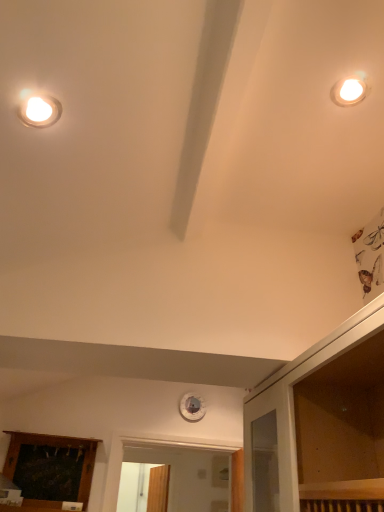
Question: Would you say transparent glass dresser at upper right is part of wooden panel at lower left's contents?

Choices:
 (A) yes
 (B) no

Answer: (B)

Question: Is wooden panel at lower left not within transparent glass dresser at upper right?

Choices:
 (A) yes
 (B) no

Answer: (A)

Question: Does wooden panel at lower left have a larger size compared to transparent glass dresser at upper right?

Choices:
 (A) no
 (B) yes

Answer: (A)

Question: Is the surface of wooden panel at lower left in direct contact with transparent glass dresser at upper right?

Choices:
 (A) no
 (B) yes

Answer: (A)

Question: From a real-world perspective, is wooden panel at lower left positioned over transparent glass dresser at upper right based on gravity?

Choices:
 (A) no
 (B) yes

Answer: (A)

Question: Does wooden panel at lower left lie behind transparent glass dresser at upper right?

Choices:
 (A) no
 (B) yes

Answer: (B)

Question: Considering the relative positions of transparent glass dresser at upper right and wooden panel at lower left in the image provided, is transparent glass dresser at upper right behind wooden panel at lower left?

Choices:
 (A) yes
 (B) no

Answer: (B)

Question: Does transparent glass dresser at upper right appear on the right side of wooden panel at lower left?

Choices:
 (A) yes
 (B) no

Answer: (A)

Question: Is transparent glass dresser at upper right oriented towards wooden panel at lower left?

Choices:
 (A) yes
 (B) no

Answer: (B)

Question: From the image's perspective, does transparent glass dresser at upper right appear lower than wooden panel at lower left?

Choices:
 (A) yes
 (B) no

Answer: (B)

Question: Is transparent glass dresser at upper right positioned before wooden panel at lower left?

Choices:
 (A) yes
 (B) no

Answer: (A)

Question: From the image's perspective, would you say transparent glass dresser at upper right is positioned over wooden panel at lower left?

Choices:
 (A) no
 (B) yes

Answer: (B)

Question: From a real-world perspective, is transparent glass dresser at upper right above or below wooden panel at lower left?

Choices:
 (A) above
 (B) below

Answer: (A)